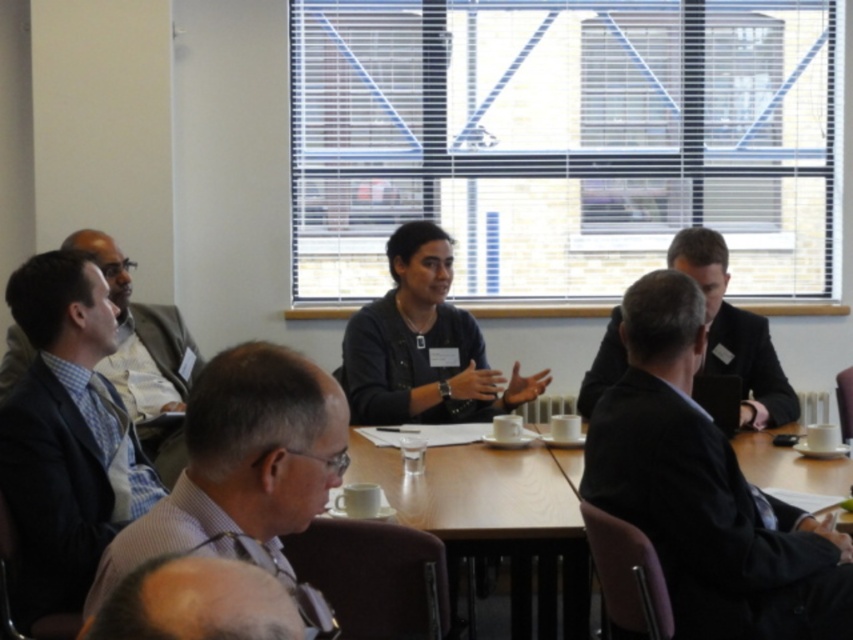
Question: Which point is closer to the camera?

Choices:
 (A) gray fabric shirt at lower center
 (B) dark blue suit at left
 (C) black suit at center
 (D) wooden table at center

Answer: (A)

Question: Can you confirm if dark blue suit at left is positioned to the left of black suit at center?

Choices:
 (A) yes
 (B) no

Answer: (A)

Question: Is the position of dark blue suit at left more distant than that of gray textured shirt at lower left?

Choices:
 (A) no
 (B) yes

Answer: (B)

Question: Which object is farther from the camera taking this photo?

Choices:
 (A) gray textured shirt at lower left
 (B) dark suit at center
 (C) wooden table at center

Answer: (C)

Question: Which object is the closest to the dark suit at center?

Choices:
 (A) gray fabric shirt at lower center
 (B) dark blue suit at left
 (C) black suit at center

Answer: (C)

Question: Can you confirm if gray textured shirt at lower left is smaller than gray fabric shirt at lower center?

Choices:
 (A) yes
 (B) no

Answer: (B)